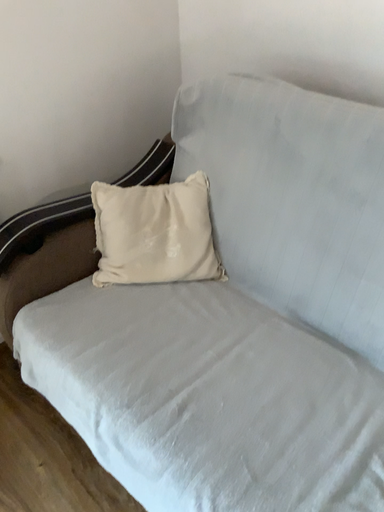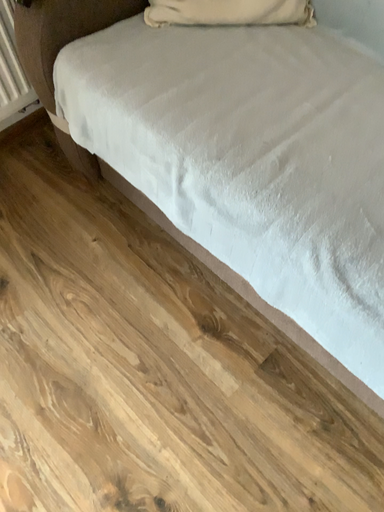
Question: Which way did the camera rotate in the video?

Choices:
 (A) rotated downward
 (B) rotated upward

Answer: (A)